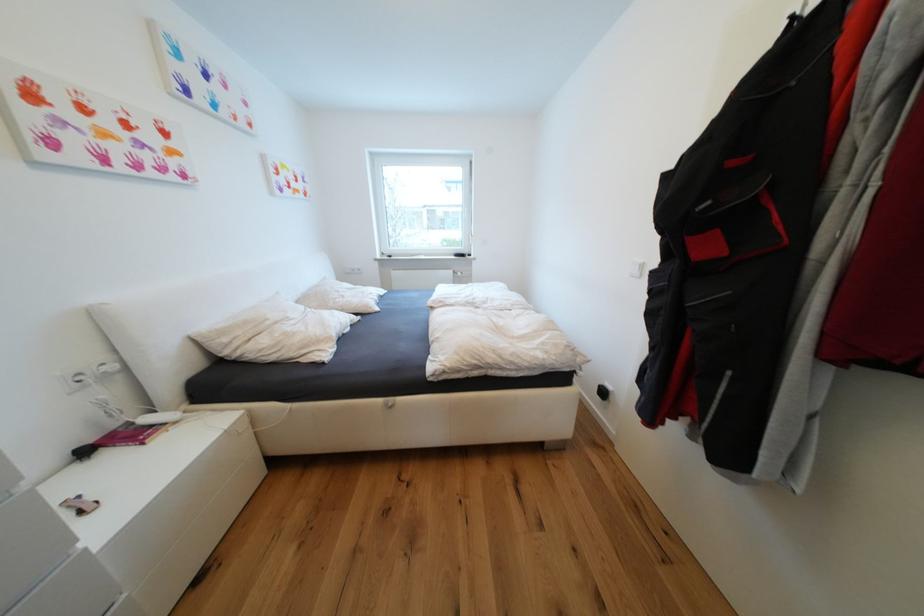
Find where to pull the window handle. Please return your answer as a coordinate pair (x, y).

(475, 230)